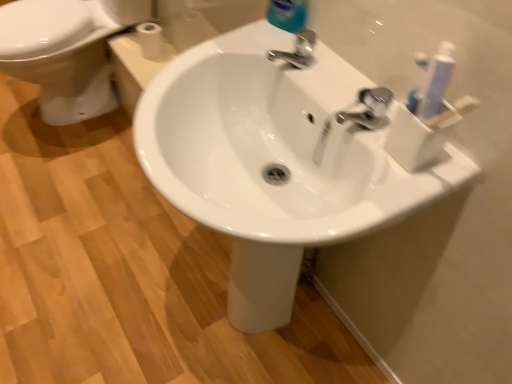
Image resolution: width=512 pixels, height=384 pixels. Identify the location of free point behind polished chrome faucet at upper right, which is counted as the first tap, starting from the right. (331, 67).